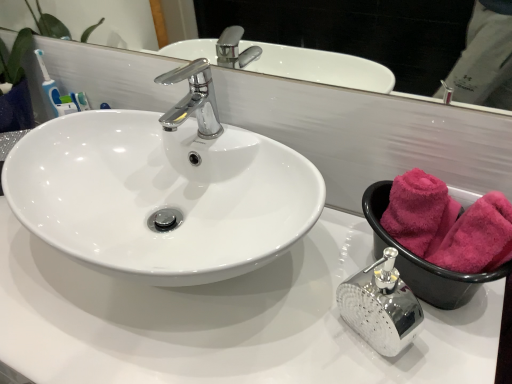
Question: In terms of size, does pink soft towel at right appear bigger or smaller than pink fluffy towel at right, arranged as the 1th bath towel when viewed from the back?

Choices:
 (A) small
 (B) big

Answer: (B)

Question: Is pink soft towel at right taller or shorter than pink fluffy towel at right, which appears as the second bath towel when viewed from the front?

Choices:
 (A) short
 (B) tall

Answer: (A)

Question: Which object is the closest to the pink fluffy towel at right, which appears as the second bath towel when viewed from the front?

Choices:
 (A) glossy white mirror at upper center
 (B) polished chrome soap dispenser at lower right
 (C) pink soft towel at right
 (D) white glossy sink at center
 (E) chrome/metallic faucet at center

Answer: (C)

Question: Estimate the real-world distances between objects in this image. Which object is closer to the polished chrome soap dispenser at lower right?

Choices:
 (A) white glossy sink at center
 (B) glossy white mirror at upper center
 (C) pink fluffy towel at right, which appears as the second bath towel when viewed from the front
 (D) chrome/metallic faucet at center
 (E) pink fluffy towels at right, positioned as the second bath towel in back-to-front order

Answer: (C)